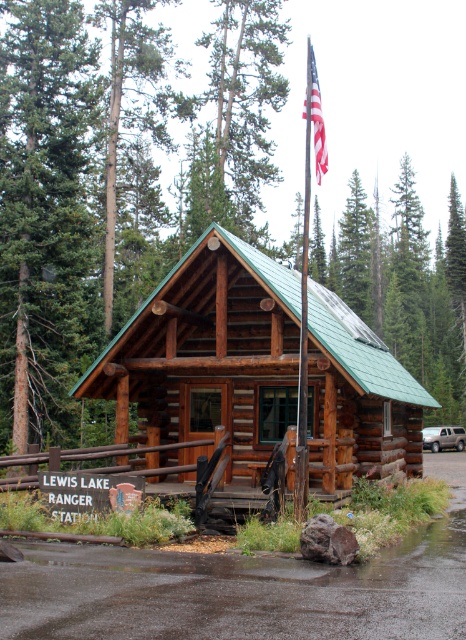
Is green wood tree at upper center thinner than metallic flag pole at upper center?

In fact, green wood tree at upper center might be wider than metallic flag pole at upper center.

Which is above, green wood tree at upper center or metallic flag pole at upper center?

metallic flag pole at upper center

Identify the location of green wood tree at upper center. This screenshot has height=640, width=466. (404, 285).

Find the location of a particular element. This screenshot has height=640, width=466. green wood tree at upper center is located at coordinates (404, 285).

Can you confirm if green coniferous tree at left is thinner than satin silver suv at right?

No, green coniferous tree at left is not thinner than satin silver suv at right.

Does point (54, 122) come closer to viewer compared to point (433, 426)?

That is True.

The width and height of the screenshot is (466, 640). In order to click on green coniferous tree at left in this screenshot , I will do `click(47, 216)`.

Is green wood tree at upper center to the left of american flag at upper center from the viewer's perspective?

In fact, green wood tree at upper center is to the right of american flag at upper center.

Does green wood tree at upper center appear under american flag at upper center?

Yes, green wood tree at upper center is below american flag at upper center.

Locate an element on the screen. green wood tree at upper center is located at coordinates (404, 285).

In order to click on green wood tree at upper center in this screenshot , I will do `click(404, 285)`.